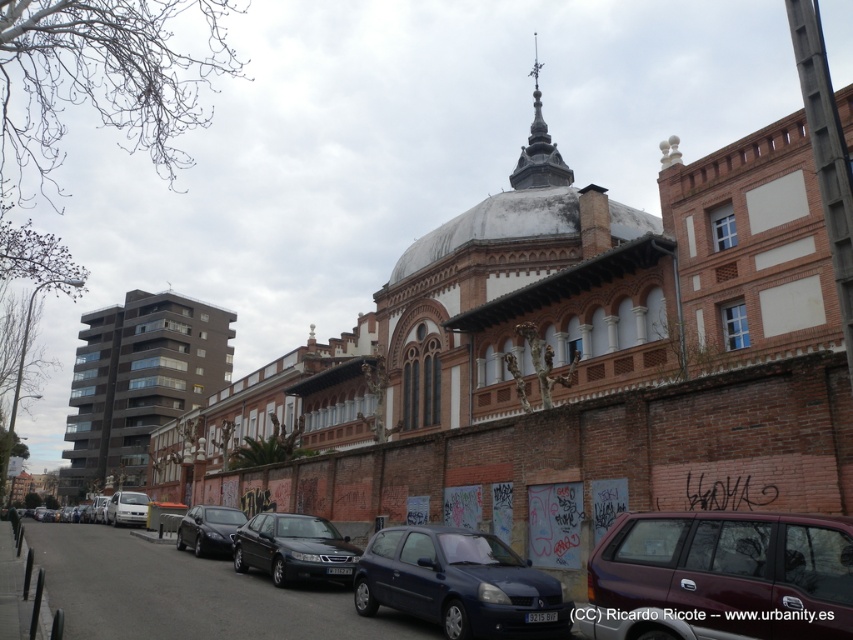
Can you confirm if metallic gray sedan at lower right is positioned to the right of satin black sedan at center?

Yes, metallic gray sedan at lower right is to the right of satin black sedan at center.

Is metallic gray sedan at lower right further to camera compared to satin black sedan at center?

No, it is not.

Identify the location of metallic gray sedan at lower right. The height and width of the screenshot is (640, 853). (720, 577).

Does matte blue hatchback at center have a lesser width compared to satin black sedan at center?

No, matte blue hatchback at center is not thinner than satin black sedan at center.

This screenshot has width=853, height=640. I want to click on matte blue hatchback at center, so pyautogui.click(x=459, y=582).

Image resolution: width=853 pixels, height=640 pixels. What are the coordinates of `matte blue hatchback at center` in the screenshot? It's located at (459, 582).

Does white textured dome at center have a larger size compared to white matte van at lower left?

Indeed, white textured dome at center has a larger size compared to white matte van at lower left.

Is white textured dome at center taller than white matte van at lower left?

Correct, white textured dome at center is much taller as white matte van at lower left.

Which is behind, point (540, 208) or point (122, 506)?

Point (122, 506)

Where is `white textured dome at center`? This screenshot has height=640, width=853. white textured dome at center is located at coordinates (508, 208).